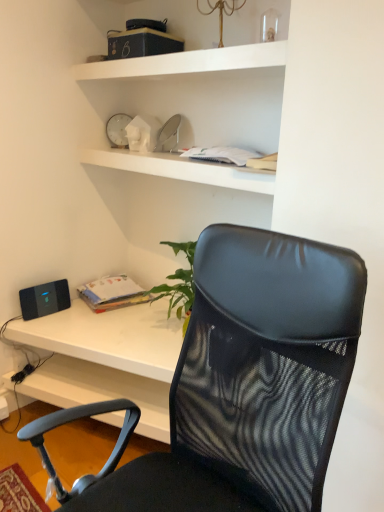
The width and height of the screenshot is (384, 512). I want to click on free location to the right of black matte speaker at lower left, so click(68, 316).